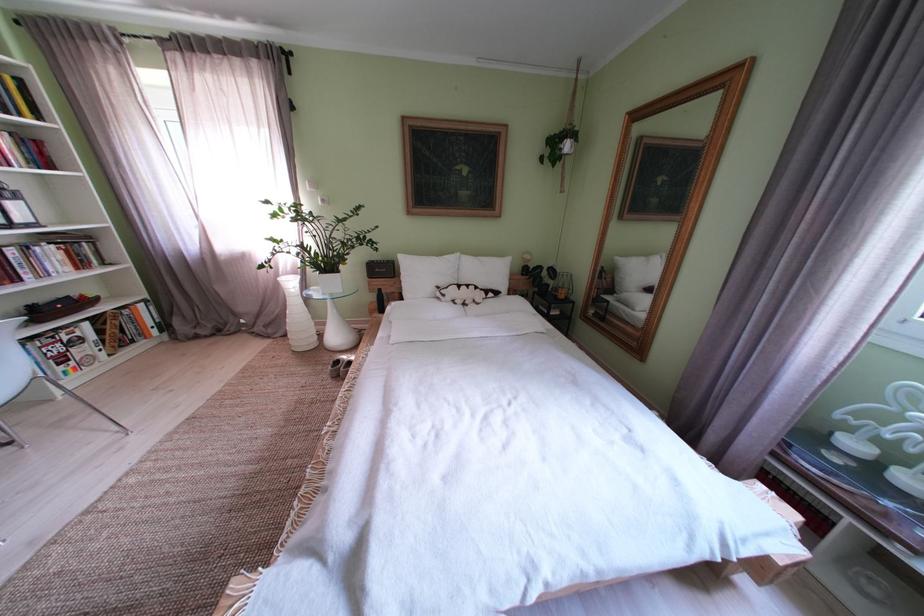
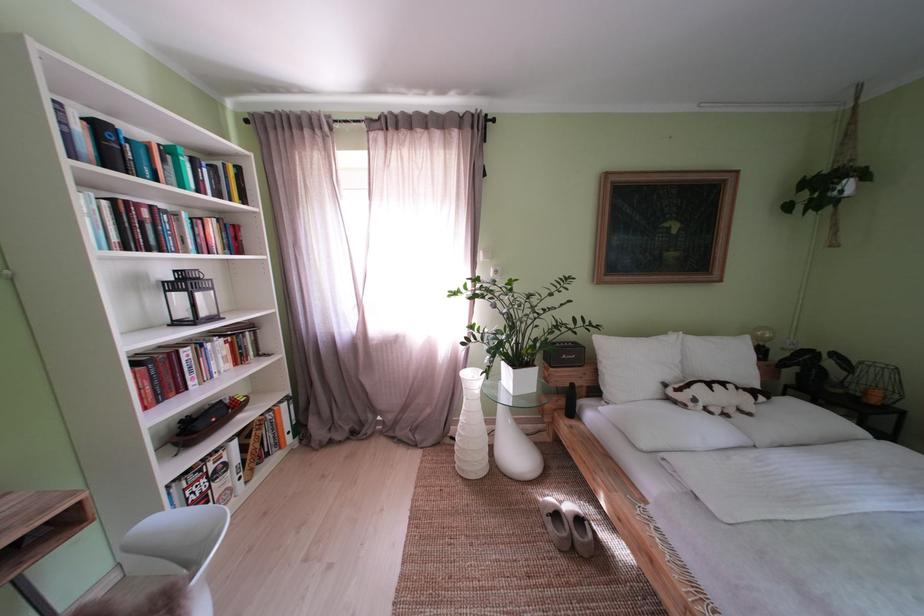
In a continuous first-person perspective shot, in which direction is the camera moving?

The cameraman walked toward left, forward.